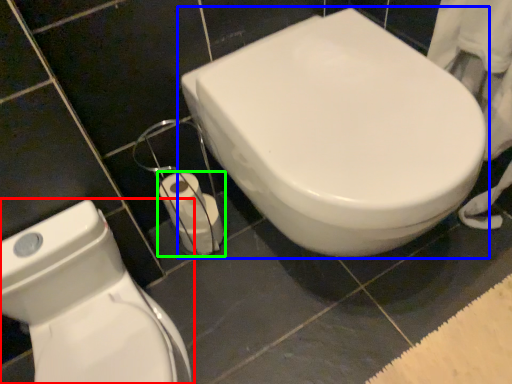
Question: Which is farther away from toilet (highlighted by a red box)? toilet (highlighted by a blue box) or toilet paper (highlighted by a green box)?

Choices:
 (A) toilet
 (B) toilet paper

Answer: (A)